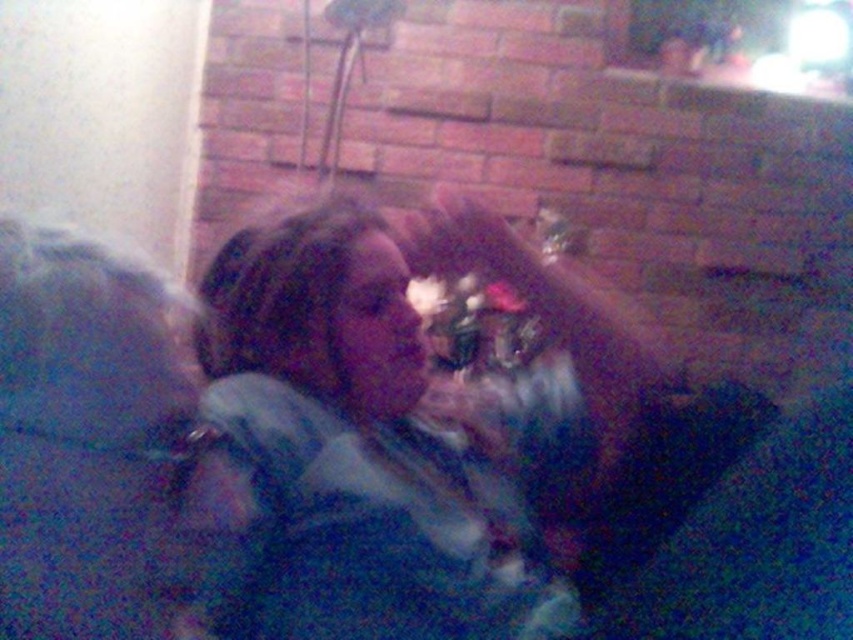
You are a fashion designer observing a model wearing a matte blue shirt at center and dark blue fabric at left. Which item is positioned higher on the model?

The matte blue shirt at center is positioned higher on the model than the dark blue fabric at left.

You are a photographer setting up a shot in this living room. You want to place a small prop exactly at the coordinates where the matte blue shirt at center is located. What are the coordinates you should aim for?

The coordinates for the matte blue shirt at center are at point (x=389, y=433). You should aim for those coordinates.